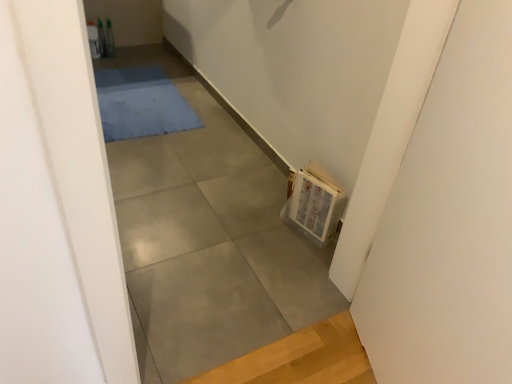
Identify the location of vacant area that lies in front of wooden frame at right. This screenshot has height=384, width=512. (300, 255).